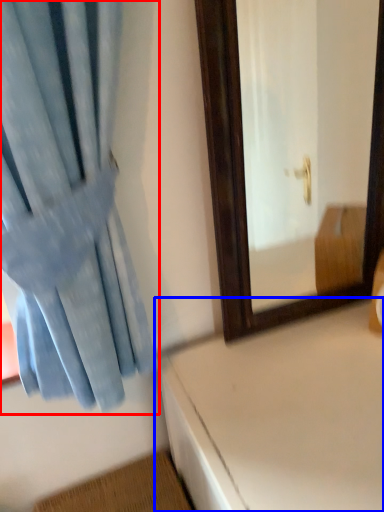
Question: Which object is further to the camera taking this photo, curtain (highlighted by a red box) or table (highlighted by a blue box)?

Choices:
 (A) curtain
 (B) table

Answer: (B)